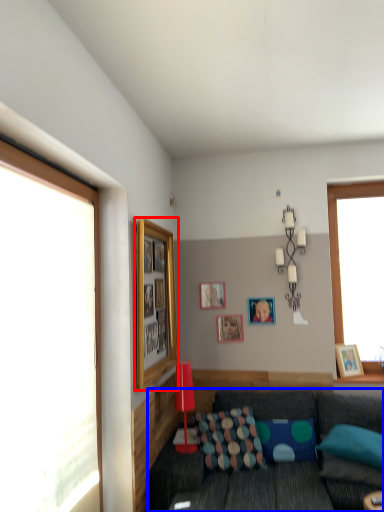
Question: Which object is further to the camera taking this photo, picture frame (highlighted by a red box) or studio couch (highlighted by a blue box)?

Choices:
 (A) picture frame
 (B) studio couch

Answer: (A)